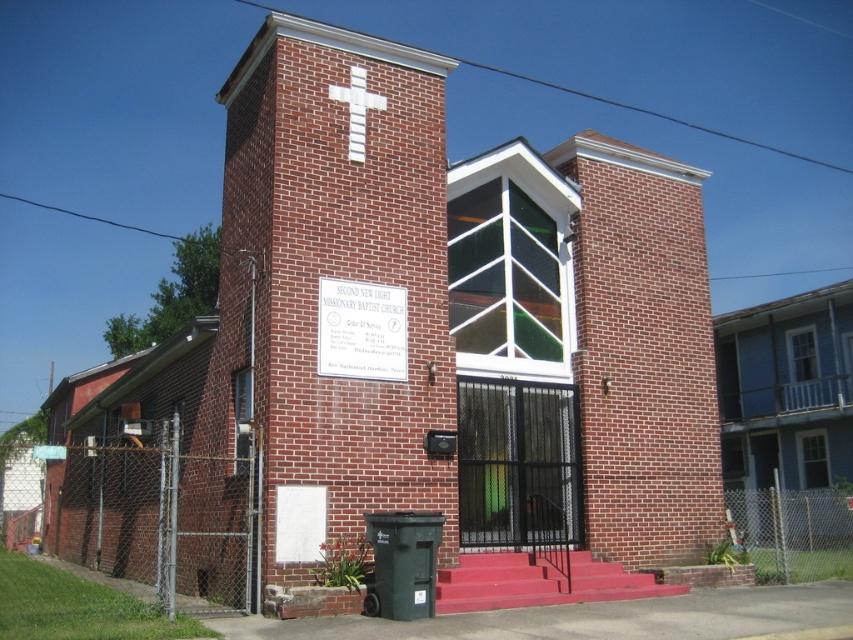
Question: Does white plastic sign at center appear on the left side of white painted cross at upper center?

Choices:
 (A) no
 (B) yes

Answer: (A)

Question: Is white plastic sign at center thinner than white painted cross at upper center?

Choices:
 (A) no
 (B) yes

Answer: (A)

Question: From the image, what is the correct spatial relationship of white plastic sign at center in relation to white painted cross at upper center?

Choices:
 (A) left
 (B) right

Answer: (B)

Question: Which of the following is the closest to the observer?

Choices:
 (A) (358, 148)
 (B) (381, 321)

Answer: (B)